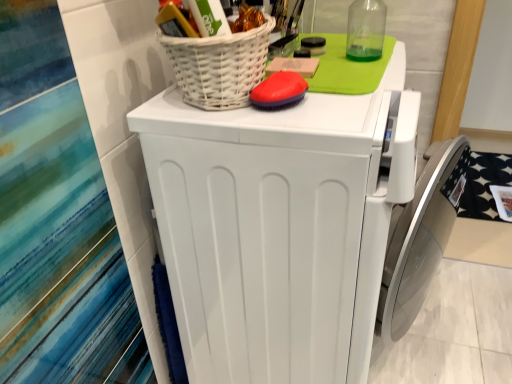
Identify the location of free location to the right of white wicker basket at upper center. The image size is (512, 384). (341, 108).